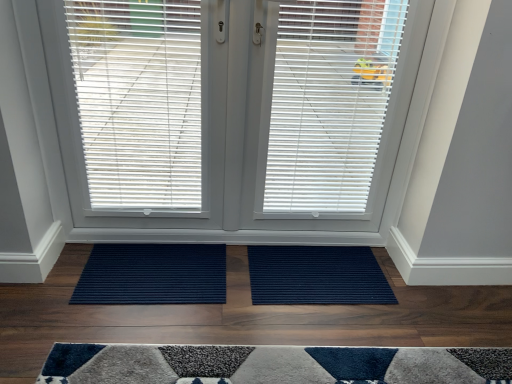
Question: In which direction should I rotate to look at white matte window blind at center, the 2th window blind when ordered from left to right?

Choices:
 (A) right
 (B) left

Answer: (B)

Question: From a real-world perspective, is white plastic blinds at center, the 3th window blind in the right-to-left sequence, beneath white matte window blind at center, placed as the 3th window blind when sorted from left to right?

Choices:
 (A) no
 (B) yes

Answer: (B)

Question: Is white plastic blinds at center, the 3th window blind in the right-to-left sequence, outside of white matte window blind at center, placed as the first window blind when sorted from right to left?

Choices:
 (A) yes
 (B) no

Answer: (A)

Question: Is white plastic blinds at center, the 1th window blind in the left-to-right sequence, to the right of white matte window blind at center, placed as the first window blind when sorted from right to left, from the viewer's perspective?

Choices:
 (A) no
 (B) yes

Answer: (A)

Question: Is white plastic blinds at center, the 3th window blind in the right-to-left sequence, positioned with its back to white matte window blind at center, placed as the first window blind when sorted from right to left?

Choices:
 (A) no
 (B) yes

Answer: (A)

Question: Does white plastic blinds at center, the 3th window blind in the right-to-left sequence, have a lesser width compared to white matte window blind at center, placed as the 3th window blind when sorted from left to right?

Choices:
 (A) no
 (B) yes

Answer: (B)

Question: Does white plastic blinds at center, the 1th window blind in the left-to-right sequence, touch white matte window blind at center, placed as the first window blind when sorted from right to left?

Choices:
 (A) no
 (B) yes

Answer: (A)

Question: Is white matte window blind at center, the second window blind viewed from the right, far from navy ribbed mat at center, acting as the 1th doormat starting from the left?

Choices:
 (A) yes
 (B) no

Answer: (B)

Question: Does white matte window blind at center, the 2th window blind when ordered from left to right, lie in front of navy ribbed mat at center, which is counted as the 2th doormat, starting from the right?

Choices:
 (A) no
 (B) yes

Answer: (B)

Question: Considering the relative sizes of white matte window blind at center, the second window blind viewed from the right, and navy ribbed mat at center, acting as the 1th doormat starting from the left, in the image provided, is white matte window blind at center, the second window blind viewed from the right, wider than navy ribbed mat at center, acting as the 1th doormat starting from the left,?

Choices:
 (A) yes
 (B) no

Answer: (B)

Question: From a real-world perspective, is white matte window blind at center, the second window blind viewed from the right, on top of navy ribbed mat at center, which is counted as the 2th doormat, starting from the right?

Choices:
 (A) no
 (B) yes

Answer: (B)

Question: Is white matte window blind at center, the 2th window blind when ordered from left to right, smaller than navy ribbed mat at center, which is counted as the 2th doormat, starting from the right?

Choices:
 (A) no
 (B) yes

Answer: (A)

Question: From the image's perspective, is white matte window blind at center, the 2th window blind when ordered from left to right, beneath navy ribbed mat at center, which is counted as the 2th doormat, starting from the right?

Choices:
 (A) yes
 (B) no

Answer: (B)

Question: Is white matte window blind at center, placed as the 3th window blind when sorted from left to right, wider than white matte window blind at center, the second window blind viewed from the right?

Choices:
 (A) yes
 (B) no

Answer: (B)